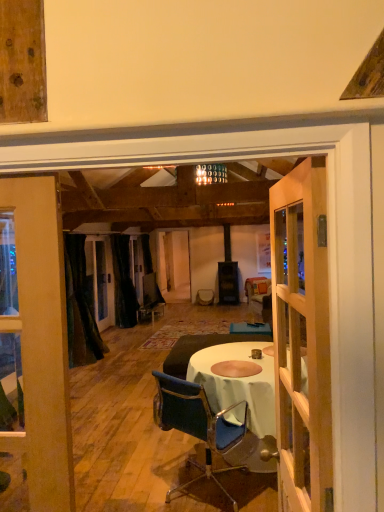
This screenshot has width=384, height=512. I want to click on blue fabric chair at center, so click(x=196, y=424).

Where is `black velvet curtain at left, which is the 2th curtain from back to front`? The width and height of the screenshot is (384, 512). black velvet curtain at left, which is the 2th curtain from back to front is located at coordinates (80, 306).

Image resolution: width=384 pixels, height=512 pixels. Find the location of `blue fabric chair at center`. blue fabric chair at center is located at coordinates (196, 424).

From the picture: Is wooden door at center not inside clear glass window at left?

Yes, wooden door at center is outside of clear glass window at left.

In terms of height, does wooden door at center look taller or shorter compared to clear glass window at left?

Considering their sizes, wooden door at center has less height than clear glass window at left.

Can you confirm if wooden door at center is wider than clear glass window at left?

Incorrect, the width of wooden door at center does not surpass that of clear glass window at left.

From the image's perspective, is wooden door at center over clear glass window at left?

Yes, from the image's perspective, wooden door at center is on top of clear glass window at left.

Considering the relative sizes of black velvet curtain at center, the 2th curtain from the front, and dark brown leather couch at center in the image provided, is black velvet curtain at center, the 2th curtain from the front, wider than dark brown leather couch at center?

No.

Locate an element on the screen. The width and height of the screenshot is (384, 512). the 1st curtain to the left of the dark brown leather couch at center, counting from the anchor's position is located at coordinates (123, 283).

Which is closer, (118, 311) or (166, 365)?

Positioned in front is point (166, 365).

Does black velvet curtain at center, which is counted as the first curtain, starting from the back, have a smaller size compared to dark brown leather couch at center?

Correct, black velvet curtain at center, which is counted as the first curtain, starting from the back, occupies less space than dark brown leather couch at center.

Consider the image. Considering the sizes of clear glass window at left and black velvet curtain at center, which is counted as the first curtain, starting from the back, in the image, is clear glass window at left wider or thinner than black velvet curtain at center, which is counted as the first curtain, starting from the back,?

Clearly, clear glass window at left has more width compared to black velvet curtain at center, which is counted as the first curtain, starting from the back.

Considering the relative positions of clear glass window at left and black velvet curtain at center, which is counted as the first curtain, starting from the back, in the image provided, is clear glass window at left to the right of black velvet curtain at center, which is counted as the first curtain, starting from the back, from the viewer's perspective?

In fact, clear glass window at left is to the left of black velvet curtain at center, which is counted as the first curtain, starting from the back.

Is clear glass window at left far from black velvet curtain at center, the 2th curtain from the front?

Yes, clear glass window at left and black velvet curtain at center, the 2th curtain from the front, are quite far apart.

Which point is more distant from viewer, (22, 384) or (226, 421)?

The point (226, 421) is farther.

Which of these two, clear glass window at left or blue fabric chair at center, is thinner?

Thinner between the two is clear glass window at left.

Who is shorter, clear glass window at left or blue fabric chair at center?

blue fabric chair at center is shorter.

From a real-world perspective, is clear glass window at left above or below blue fabric chair at center?

In terms of real-world spatial position, clear glass window at left is above blue fabric chair at center.

Between dark brown leather couch at center and clear glass window at left, which one appears on the right side from the viewer's perspective?

dark brown leather couch at center.

In order to click on studio couch behind the clear glass window at left in this screenshot , I will do `click(201, 349)`.

Which object is thinner, dark brown leather couch at center or clear glass window at left?

With smaller width is clear glass window at left.

What's the angular difference between dark brown leather couch at center and clear glass window at left's facing directions?

179 degrees.

Considering the relative sizes of black velvet curtain at left, placed as the 1th curtain when sorted from front to back, and wooden door at center in the image provided, is black velvet curtain at left, placed as the 1th curtain when sorted from front to back, thinner than wooden door at center?

No, black velvet curtain at left, placed as the 1th curtain when sorted from front to back, is not thinner than wooden door at center.

From a real-world perspective, count 1st curtains downward from the wooden door at center and point to it. Please provide its 2D coordinates.

[(80, 306)]

In the image, is black velvet curtain at left, which is the 2th curtain from back to front, positioned in front of or behind wooden door at center?

Visually, black velvet curtain at left, which is the 2th curtain from back to front, is located behind wooden door at center.

From a real-world perspective, is black velvet curtain at left, placed as the 1th curtain when sorted from front to back, positioned under wooden door at center based on gravity?

Yes, from a real-world perspective, black velvet curtain at left, placed as the 1th curtain when sorted from front to back, is below wooden door at center.

Based on the photo, from a real-world perspective, which object rests below the other?

black velvet curtain at left, placed as the 1th curtain when sorted from front to back, is physically lower.

Is clear glass window at left facing towards black velvet curtain at left, which is the 2th curtain from back to front?

No, clear glass window at left is not oriented towards black velvet curtain at left, which is the 2th curtain from back to front.

Considering the relative sizes of clear glass window at left and black velvet curtain at left, which is the 2th curtain from back to front, in the image provided, is clear glass window at left shorter than black velvet curtain at left, which is the 2th curtain from back to front,?

Yes.

In the image, there is a wooden door at center. Where is `window below it (from a real-world perspective)`? window below it (from a real-world perspective) is located at coordinates (10, 332).

Locate an element on the screen. studio couch that appears in front of the black velvet curtain at center, the 2th curtain from the front is located at coordinates (201, 349).

Estimate the real-world distances between objects in this image. Which object is closer to clear glass window at left, wooden door at center or blue fabric chair at center?

blue fabric chair at center is closer to clear glass window at left.

From the image, which object appears to be nearer to black velvet curtain at left, which is the 2th curtain from back to front, wooden door at center or black velvet curtain at center, the 2th curtain from the front?

Among the two, black velvet curtain at center, the 2th curtain from the front, is located nearer to black velvet curtain at left, which is the 2th curtain from back to front.

Based on their spatial positions, is dark brown leather couch at center or black velvet curtain at left, placed as the 1th curtain when sorted from front to back, closer to blue fabric chair at center?

dark brown leather couch at center.

Based on the photo, looking at the image, which one is located closer to black velvet curtain at left, which is the 2th curtain from back to front, blue fabric chair at center or wooden door at center?

blue fabric chair at center lies closer to black velvet curtain at left, which is the 2th curtain from back to front, than the other object.

When comparing their distances from black velvet curtain at left, which is the 2th curtain from back to front, does blue fabric chair at center or dark brown leather couch at center seem further?

blue fabric chair at center is further to black velvet curtain at left, which is the 2th curtain from back to front.

Considering their positions, is black velvet curtain at left, placed as the 1th curtain when sorted from front to back, positioned further to blue fabric chair at center than black velvet curtain at center, which is counted as the first curtain, starting from the back?

→ The object further to blue fabric chair at center is black velvet curtain at center, which is counted as the first curtain, starting from the back.

From the image, which object appears to be nearer to black velvet curtain at left, which is the 2th curtain from back to front, dark brown leather couch at center or clear glass window at left?

Among the two, dark brown leather couch at center is located nearer to black velvet curtain at left, which is the 2th curtain from back to front.

When comparing their distances from blue fabric chair at center, does dark brown leather couch at center or black velvet curtain at center, which is counted as the first curtain, starting from the back, seem further?

Among the two, black velvet curtain at center, which is counted as the first curtain, starting from the back, is located further to blue fabric chair at center.

This screenshot has height=512, width=384. I want to click on chair positioned between wooden door at center and black velvet curtain at center, the 2th curtain from the front, from near to far, so click(196, 424).

You are a GUI agent. You are given a task and a screenshot of the screen. Output one action in this format:
    pyautogui.click(x=<x>, y=<y>)
    Task: Click on the window between blue fabric chair at center and black velvet curtain at left, placed as the 1th curtain when sorted from front to back, from front to back
    Image resolution: width=384 pixels, height=512 pixels.
    Given the screenshot: What is the action you would take?
    pyautogui.click(x=10, y=332)

Where is `studio couch between blue fabric chair at center and black velvet curtain at center, which is counted as the first curtain, starting from the back, in the front-back direction`? studio couch between blue fabric chair at center and black velvet curtain at center, which is counted as the first curtain, starting from the back, in the front-back direction is located at coordinates (201, 349).

This screenshot has width=384, height=512. I want to click on studio couch located between clear glass window at left and black velvet curtain at center, which is counted as the first curtain, starting from the back, in the depth direction, so click(201, 349).